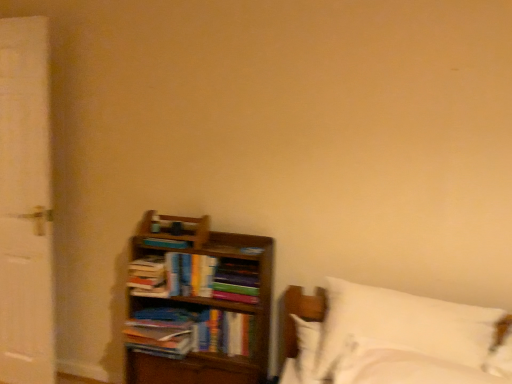
In order to click on hardcover book at left, which appears as the 1th book when viewed from the top in this screenshot , I will do `click(166, 243)`.

Measure the distance between wooden bookcase at lower left and camera.

The distance of wooden bookcase at lower left from camera is 1.83 meters.

What do you see at coordinates (398, 341) in the screenshot? This screenshot has height=384, width=512. I see `white soft bed at lower right` at bounding box center [398, 341].

This screenshot has width=512, height=384. Find the location of `hardcover books at center, the second book when ordered from bottom to top`. hardcover books at center, the second book when ordered from bottom to top is located at coordinates (236, 281).

Between hardcover book at center, which ranks as the first book in bottom-to-top order, and wooden bookcase at lower left, which one appears on the left side from the viewer's perspective?

wooden bookcase at lower left.

In the scene shown: From the image's perspective, who appears lower, hardcover book at center, which ranks as the first book in bottom-to-top order, or wooden bookcase at lower left?

hardcover book at center, which ranks as the first book in bottom-to-top order, from the image's perspective.

Is hardcover book at center, which ranks as the first book in bottom-to-top order, oriented towards wooden bookcase at lower left?

Yes, hardcover book at center, which ranks as the first book in bottom-to-top order, faces towards wooden bookcase at lower left.

Considering the sizes of objects white soft bed at lower right and hardcover books at center, the 3th book in the top-to-bottom sequence, in the image provided, who is shorter, white soft bed at lower right or hardcover books at center, the 3th book in the top-to-bottom sequence,?

With less height is hardcover books at center, the 3th book in the top-to-bottom sequence.

Relative to hardcover books at center, the 3th book in the top-to-bottom sequence, is white soft bed at lower right in front or behind?

white soft bed at lower right is positioned closer to the viewer than hardcover books at center, the 3th book in the top-to-bottom sequence.

Based on the photo, from a real-world perspective, is white soft bed at lower right physically above hardcover books at center, the 3th book in the top-to-bottom sequence?

Incorrect, from a real-world perspective, white soft bed at lower right is lower than hardcover books at center, the 3th book in the top-to-bottom sequence.

Does white soft bed at lower right turn towards hardcover books at center, the 3th book in the top-to-bottom sequence?

No, white soft bed at lower right does not turn towards hardcover books at center, the 3th book in the top-to-bottom sequence.

From a real-world perspective, relative to hardcover books at center, the 3th book in the top-to-bottom sequence, is wooden bookcase at lower left vertically above or below?

wooden bookcase at lower left is situated lower than hardcover books at center, the 3th book in the top-to-bottom sequence, in the real world.

Would you consider wooden bookcase at lower left to be distant from hardcover books at center, the 3th book in the top-to-bottom sequence?

That's not correct — wooden bookcase at lower left is a little close to hardcover books at center, the 3th book in the top-to-bottom sequence.

This screenshot has height=384, width=512. What are the coordinates of `book that is the 1st object located above the wooden bookcase at lower left (from the image's perspective)` in the screenshot? It's located at (236, 281).

How distant is wooden bookcase at lower left from hardcover books at center, the second book when ordered from bottom to top?

wooden bookcase at lower left and hardcover books at center, the second book when ordered from bottom to top, are 7.58 inches apart.

Is white painted wood screen door at left to the right of wooden bookcase at lower left from the viewer's perspective?

No, white painted wood screen door at left is not to the right of wooden bookcase at lower left.

Is white painted wood screen door at left positioned far away from wooden bookcase at lower left?

white painted wood screen door at left is near wooden bookcase at lower left, not far away.

Looking at this image, from the image's perspective, is white painted wood screen door at left beneath wooden bookcase at lower left?

No, from the image's perspective, white painted wood screen door at left is not beneath wooden bookcase at lower left.

Considering the relative sizes of white painted wood screen door at left and wooden bookcase at lower left in the image provided, is white painted wood screen door at left shorter than wooden bookcase at lower left?

No, white painted wood screen door at left is not shorter than wooden bookcase at lower left.

Considering the points (199, 345) and (24, 93), which point is behind, point (199, 345) or point (24, 93)?

The point (24, 93) is farther.

Which of these two, hardcover book at center, which ranks as the first book in bottom-to-top order, or white painted wood screen door at left, is smaller?

With smaller size is hardcover book at center, which ranks as the first book in bottom-to-top order.

Is hardcover book at center, which ranks as the first book in bottom-to-top order, completely or partially outside of white painted wood screen door at left?

That's correct, hardcover book at center, which ranks as the first book in bottom-to-top order, is outside of white painted wood screen door at left.

Can you confirm if hardcover book at center, the fourth book positioned from the top, is thinner than white painted wood screen door at left?

No, hardcover book at center, the fourth book positioned from the top, is not thinner than white painted wood screen door at left.

The height and width of the screenshot is (384, 512). Identify the location of bed in front of the hardcover book at left, which appears as the 1th book when viewed from the top. (398, 341).

Can you confirm if hardcover book at left, positioned as the fourth book in bottom-to-top order, is positioned to the right of white soft bed at lower right?

In fact, hardcover book at left, positioned as the fourth book in bottom-to-top order, is to the left of white soft bed at lower right.

From a real-world perspective, which is physically below, hardcover book at left, positioned as the fourth book in bottom-to-top order, or white soft bed at lower right?

From a 3D spatial view, white soft bed at lower right is below.

Is hardcover book at left, which appears as the 1th book when viewed from the top, next to white soft bed at lower right and touching it?

There is a gap between hardcover book at left, which appears as the 1th book when viewed from the top, and white soft bed at lower right.

Does wooden bookcase at lower left appear on the right side of hardcover book at center, the fourth book positioned from the top?

No.

Locate an element on the screen. This screenshot has width=512, height=384. the 1st book to the right when counting from the wooden bookcase at lower left is located at coordinates (224, 333).

From the image's perspective, between wooden bookcase at lower left and hardcover book at center, which ranks as the first book in bottom-to-top order, which one is located above?

From the image's view, wooden bookcase at lower left is above.

Where is `bookcase above the hardcover book at center, the fourth book positioned from the top (from the image's perspective)`? bookcase above the hardcover book at center, the fourth book positioned from the top (from the image's perspective) is located at coordinates (198, 305).

The width and height of the screenshot is (512, 384). Identify the location of the 2nd book above the white soft bed at lower right (from a real-world perspective). (236, 281).

From the image, which object appears to be nearer to white painted wood screen door at left, wooden bookcase at lower left or hardcover book at left, positioned as the fourth book in bottom-to-top order?

wooden bookcase at lower left is closer to white painted wood screen door at left.

From the image, which object appears to be nearer to white soft bed at lower right, hardcover book at left, which appears as the 1th book when viewed from the top, or wooden bookcase at lower left?

wooden bookcase at lower left.

Estimate the real-world distances between objects in this image. Which object is closer to white painted wood screen door at left, hardcover book at left, positioned as the fourth book in bottom-to-top order, or hardcover book at center, the fourth book positioned from the top?

The object closer to white painted wood screen door at left is hardcover book at left, positioned as the fourth book in bottom-to-top order.

Estimate the real-world distances between objects in this image. Which object is further from wooden bookcase at lower left, hardcover books at center, the second book when ordered from bottom to top, or hardcover book at left, which appears as the 1th book when viewed from the top?

hardcover book at left, which appears as the 1th book when viewed from the top, is positioned further to the anchor wooden bookcase at lower left.

Which object lies nearer to the anchor point hardcover book at left, positioned as the fourth book in bottom-to-top order, white painted wood screen door at left or wooden bookcase at lower left?

wooden bookcase at lower left is positioned closer to the anchor hardcover book at left, positioned as the fourth book in bottom-to-top order.

Based on their spatial positions, is wooden bookcase at lower left or hardcover book at center, which ranks as the first book in bottom-to-top order, further from white soft bed at lower right?

The object further to white soft bed at lower right is wooden bookcase at lower left.

Which object lies nearer to the anchor point white soft bed at lower right, hardcover book at left, which appears as the 1th book when viewed from the top, or hardcover books at left, which appears as the 3th book when ordered from the bottom?

hardcover books at left, which appears as the 3th book when ordered from the bottom.

When comparing their distances from hardcover books at left, which appears as the 2th book when viewed from the top, does hardcover book at center, which ranks as the first book in bottom-to-top order, or hardcover book at left, which appears as the 1th book when viewed from the top, seem closer?

hardcover book at left, which appears as the 1th book when viewed from the top, is positioned closer to the anchor hardcover books at left, which appears as the 2th book when viewed from the top.

The height and width of the screenshot is (384, 512). Identify the location of bookcase between white painted wood screen door at left and hardcover books at center, the 3th book in the top-to-bottom sequence. (198, 305).

Where is `bookcase situated between hardcover books at left, which appears as the 2th book when viewed from the top, and white soft bed at lower right from left to right`? The height and width of the screenshot is (384, 512). bookcase situated between hardcover books at left, which appears as the 2th book when viewed from the top, and white soft bed at lower right from left to right is located at coordinates (198, 305).

At what (x,y) coordinates should I click in order to perform the action: click on bookcase between hardcover books at left, which appears as the 2th book when viewed from the top, and hardcover book at center, which ranks as the first book in bottom-to-top order, in the horizontal direction. Please return your answer as a coordinate pair (x, y). Looking at the image, I should click on (198, 305).

The height and width of the screenshot is (384, 512). What are the coordinates of `book situated between white painted wood screen door at left and hardcover book at left, which appears as the 1th book when viewed from the top, from left to right` in the screenshot? It's located at (148, 277).